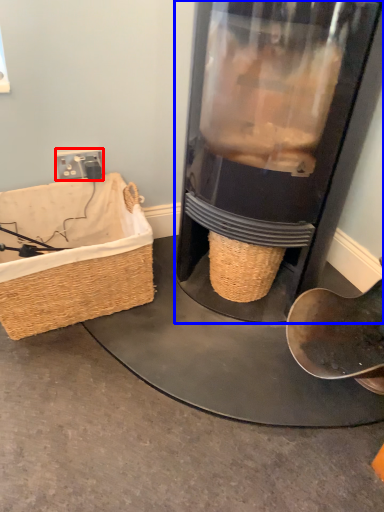
Question: Which object is further to the camera taking this photo, plug (highlighted by a red box) or appliance (highlighted by a blue box)?

Choices:
 (A) plug
 (B) appliance

Answer: (A)